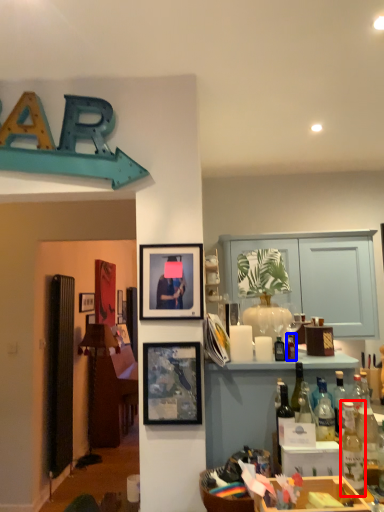
Question: Which point is further to the camera, bottle (highlighted by a red box) or bottle (highlighted by a blue box)?

Choices:
 (A) bottle
 (B) bottle

Answer: (B)